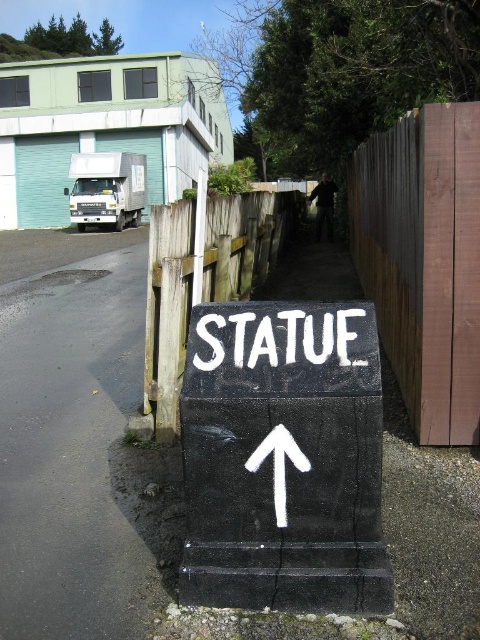
You are a delivery driver who needs to park your truck on the black asphalt at lower left. However, there is a white painted sign at center nearby. Considering their sizes, will the sign block your view of the parking spot?

The black asphalt at lower left is much taller than the white painted sign at center, so the sign will not block your view of the parking spot.

You are a tourist trying to find the statue and see both the black concrete sign at center and the white painted sign at center. According to the signs, which direction should you go?

The black concrete sign at center is positioned on the left side of white painted sign at center. Since both signs point upward, you should follow the direction indicated by the arrow on the signs, which is upward, towards the statue.

You are a delivery driver who needs to park your truck between the black asphalt at lower left and the white painted sign at center. Can you fit your truck there if your truck is 2 meters wide?

The black asphalt at lower left is wider than the white painted sign at center. However, the total width available between them is not specified. Without knowing the exact distance between the two objects, it is impossible to determine if the truck can fit.